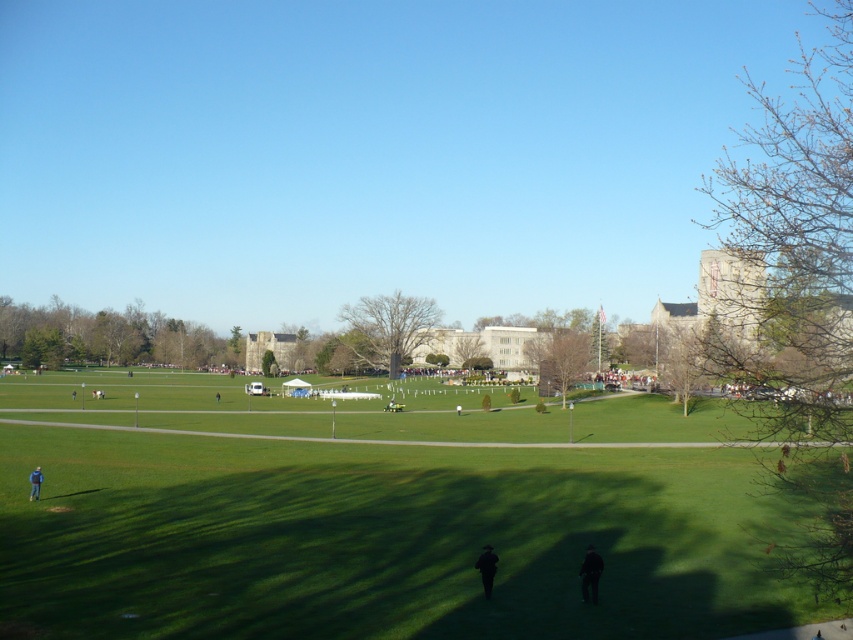
You are standing at the starting point and see the brown leafy tree at center in the distance. If you walk straight towards it for 100 meters, will you reach the tree?

The brown leafy tree at center is 102.20 meters away from the viewer. If you walk straight towards it for 100 meters, you will not reach the tree yet, as you still need to cover an additional 2.20 meters.

You are planning to set up a picnic and need to decide between the brown leafy tree at center and the dark green fabric at lower center for shade. Which option provides more shade coverage?

The brown leafy tree at center is bigger than the dark green fabric at lower center, so it provides more shade coverage.